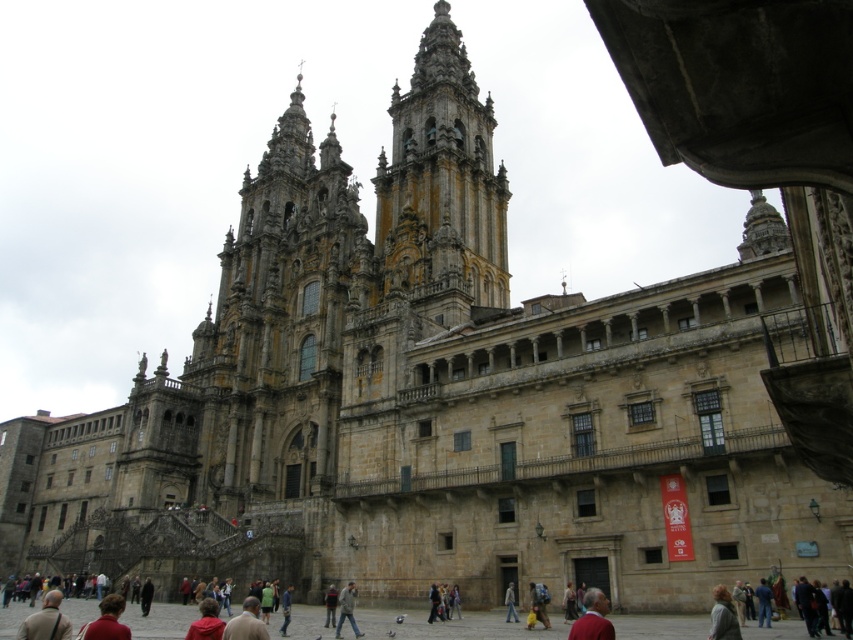
Is brown leather jacket at lower center below red fabric jacket at lower left?

Incorrect, brown leather jacket at lower center is not positioned below red fabric jacket at lower left.

Who is positioned more to the right, brown leather jacket at lower center or red fabric jacket at lower left?

From the viewer's perspective, brown leather jacket at lower center appears more on the right side.

Who is more forward, (596, 604) or (122, 611)?

Point (122, 611) is in front.

You are a GUI agent. You are given a task and a screenshot of the screen. Output one action in this format:
    pyautogui.click(x=<x>, y=<y>)
    Task: Click on the brown leather jacket at lower center
    This screenshot has width=853, height=640.
    Given the screenshot: What is the action you would take?
    pyautogui.click(x=593, y=618)

Is light brown leather jacket at lower left taller than gray fabric jacket at center?

Yes, light brown leather jacket at lower left is taller than gray fabric jacket at center.

Which is in front, point (51, 632) or point (340, 595)?

Point (51, 632) is more forward.

Is point (54, 637) more distant than point (341, 609)?

That is False.

At what (x,y) coordinates should I click in order to perform the action: click on light brown leather jacket at lower left. Please return your answer as a coordinate pair (x, y). Looking at the image, I should click on (45, 620).

What do you see at coordinates (45, 620) in the screenshot? This screenshot has height=640, width=853. I see `light brown leather jacket at lower left` at bounding box center [45, 620].

Is point (54, 628) positioned behind point (728, 609)?

No, (54, 628) is closer to viewer.

The image size is (853, 640). In order to click on light brown leather jacket at lower left in this screenshot , I will do click(45, 620).